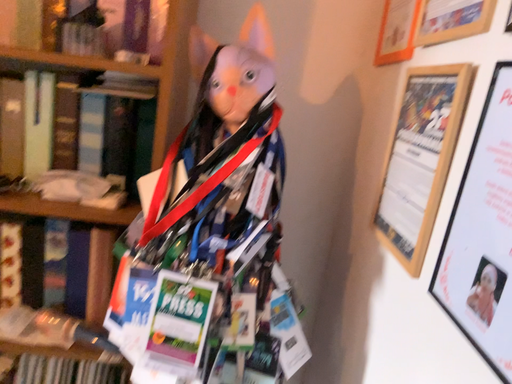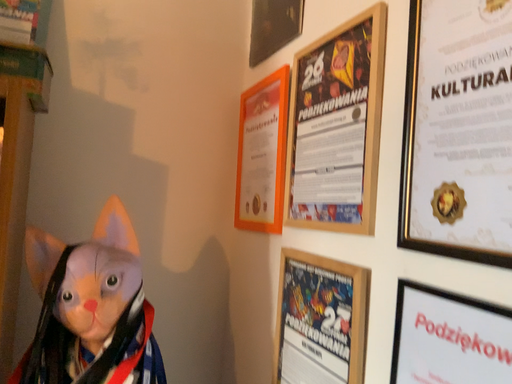
Question: Which way did the camera rotate in the video?

Choices:
 (A) rotated right
 (B) rotated left

Answer: (A)